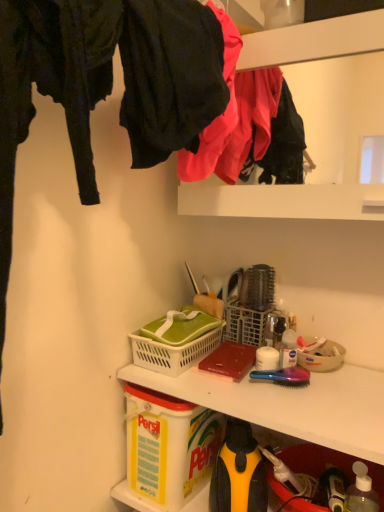
Question: Is matte black pants at upper left, which ranks as the second clothing in back-to-front order, shorter than yellow plastic container at lower left?

Choices:
 (A) yes
 (B) no

Answer: (B)

Question: Is matte black pants at upper left, which ranks as the second clothing in back-to-front order, to the left of yellow plastic container at lower left from the viewer's perspective?

Choices:
 (A) yes
 (B) no

Answer: (A)

Question: Does matte black pants at upper left, which is the first clothing in front-to-back order, appear on the right side of yellow plastic container at lower left?

Choices:
 (A) yes
 (B) no

Answer: (B)

Question: Is matte black pants at upper left, which ranks as the second clothing in back-to-front order, aimed at yellow plastic container at lower left?

Choices:
 (A) no
 (B) yes

Answer: (A)

Question: Does matte black pants at upper left, which is the first clothing in front-to-back order, have a smaller size compared to yellow plastic container at lower left?

Choices:
 (A) no
 (B) yes

Answer: (A)

Question: Is matte black pants at upper left, which is the first clothing in front-to-back order, closer to the viewer compared to yellow plastic container at lower left?

Choices:
 (A) yes
 (B) no

Answer: (A)

Question: Is white plastic bottle at center, acting as the 1th bottle starting from the left, shorter than matte pink fabric at upper center, acting as the 1th clothing starting from the back?

Choices:
 (A) no
 (B) yes

Answer: (B)

Question: Does white plastic bottle at center, which is the second bottle in bottom-to-top order, lie behind matte pink fabric at upper center, acting as the 1th clothing starting from the back?

Choices:
 (A) no
 (B) yes

Answer: (B)

Question: Is white plastic bottle at center, the 2th bottle positioned from the front, beside matte pink fabric at upper center, acting as the 1th clothing starting from the back?

Choices:
 (A) no
 (B) yes

Answer: (A)

Question: Would you consider white plastic bottle at center, the 2th bottle positioned from the front, to be distant from matte pink fabric at upper center, acting as the 1th clothing starting from the back?

Choices:
 (A) no
 (B) yes

Answer: (A)

Question: Is white plastic bottle at center, the 2th bottle in the right-to-left sequence, outside matte pink fabric at upper center, acting as the 1th clothing starting from the back?

Choices:
 (A) yes
 (B) no

Answer: (A)

Question: Is white plastic bottle at center, the 2th bottle positioned from the front, surrounding matte pink fabric at upper center, the 2th clothing in the front-to-back sequence?

Choices:
 (A) yes
 (B) no

Answer: (B)

Question: Is beige plastic bowl at center right positioned in front of transparent plastic bottle at lower right, which is counted as the 1th bottle, starting from the right?

Choices:
 (A) yes
 (B) no

Answer: (B)